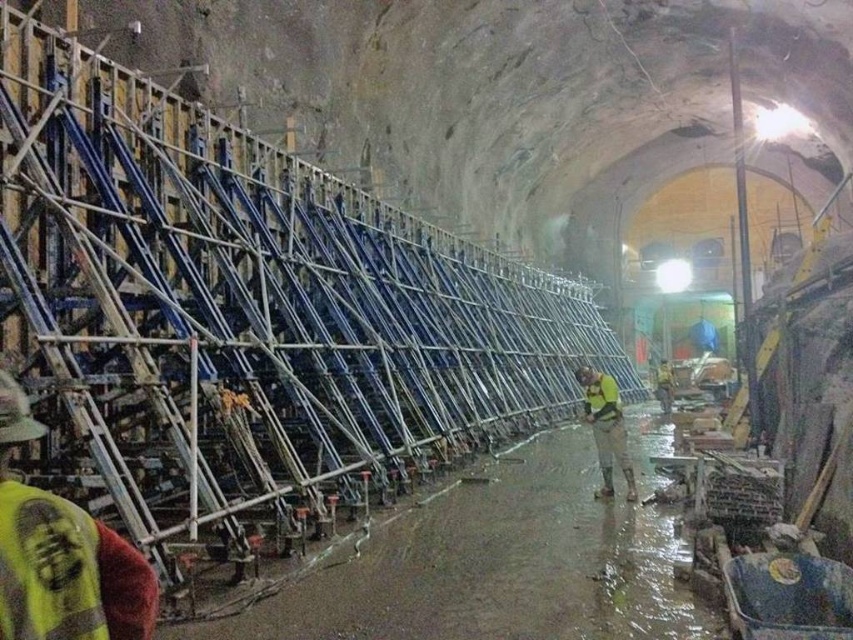
How distant is yellow reflective vest at left from yellow fabric safety vest at center?

They are 8.56 meters apart.

Does yellow reflective vest at left have a smaller size compared to yellow fabric safety vest at center?

Yes.

Between point (39, 432) and point (584, 396), which one is positioned in front?

Point (39, 432)

In order to click on yellow reflective vest at left in this screenshot , I will do `click(62, 556)`.

Between point (7, 531) and point (625, 472), which one is positioned in front?

Point (7, 531) is in front.

Is yellow reflective vest at left to the left of yellow reflective vest at center from the viewer's perspective?

Indeed, yellow reflective vest at left is positioned on the left side of yellow reflective vest at center.

Does point (67, 518) lie in front of point (605, 435)?

Yes, point (67, 518) is in front of point (605, 435).

The width and height of the screenshot is (853, 640). What are the coordinates of `yellow reflective vest at left` in the screenshot? It's located at (62, 556).

Between yellow reflective safety vest at lower left and yellow fabric safety vest at center, which one has less height?

yellow reflective safety vest at lower left

Between yellow reflective safety vest at lower left and yellow fabric safety vest at center, which one is positioned higher?

Positioned higher is yellow reflective safety vest at lower left.

Is point (6, 508) farther from camera compared to point (608, 417)?

That is False.

Locate an element on the screen. The width and height of the screenshot is (853, 640). yellow reflective safety vest at lower left is located at coordinates (47, 566).